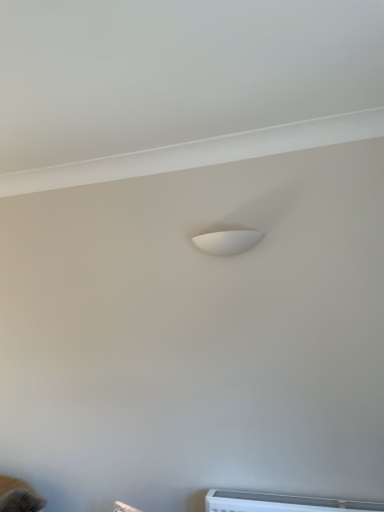
Question: Should I look upward or downward to see white matte lamp at center?

Choices:
 (A) down
 (B) up

Answer: (B)